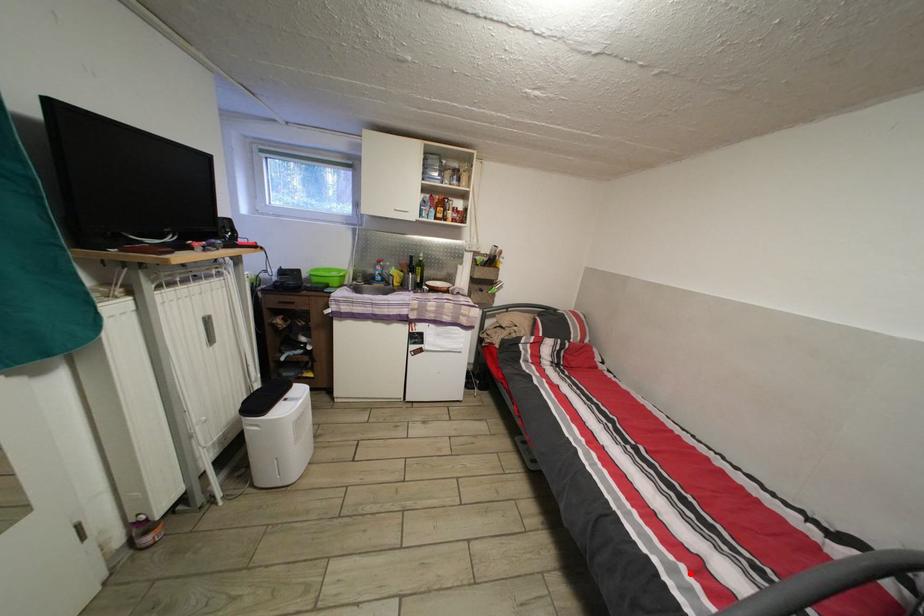
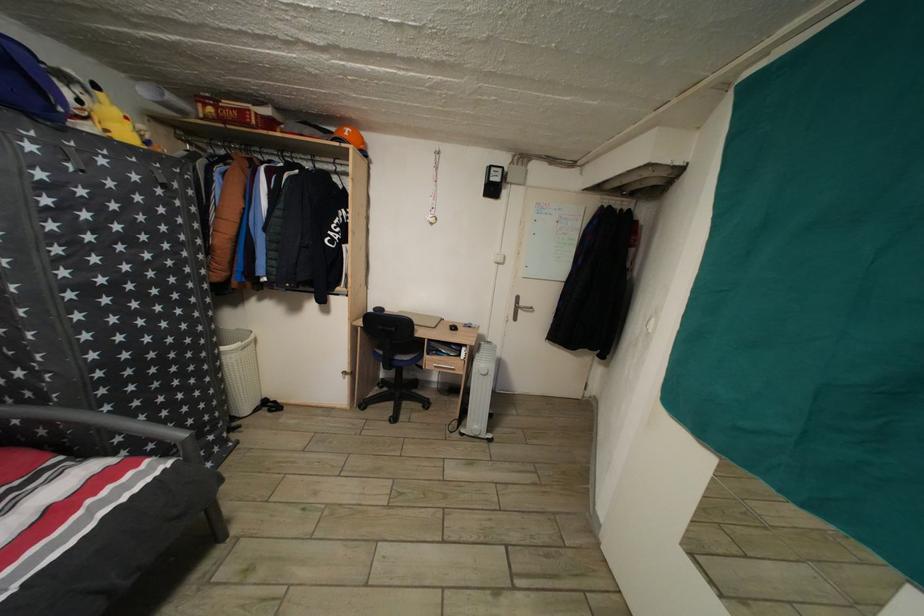
The point at the highlighted location is marked in the first image. Where is the corresponding point in the second image?

(96, 508)